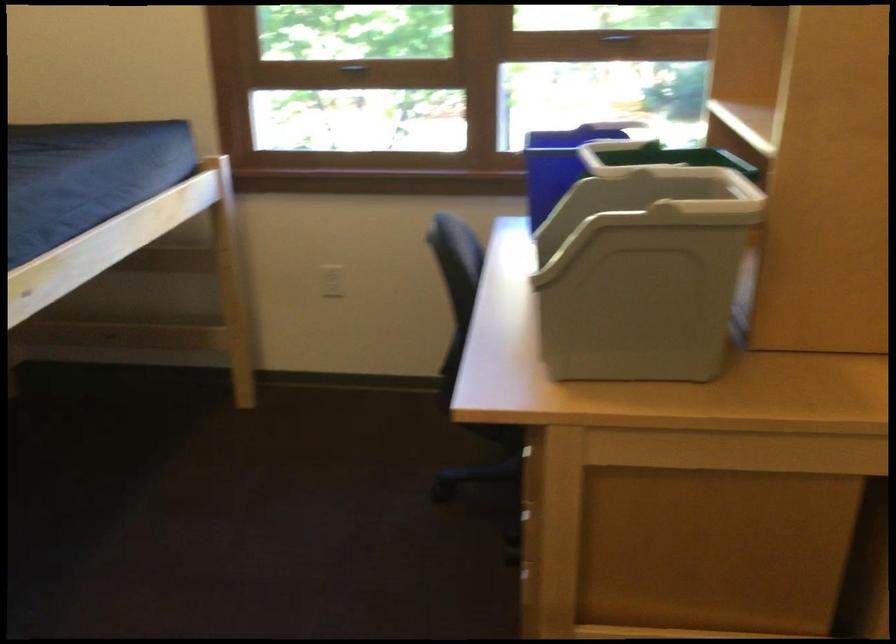
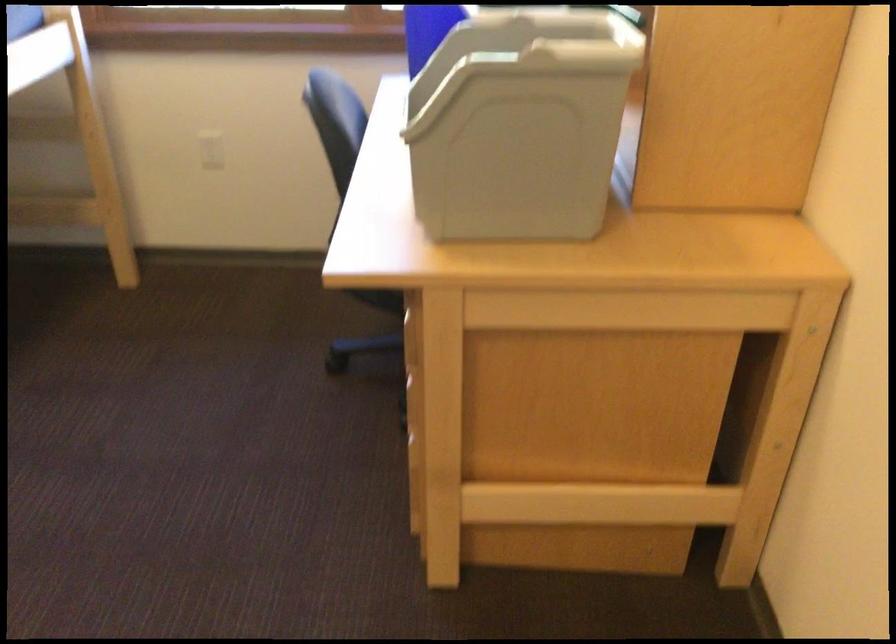
What movement of the cameraman would produce the second image?

The cameraman moved toward right, forward.